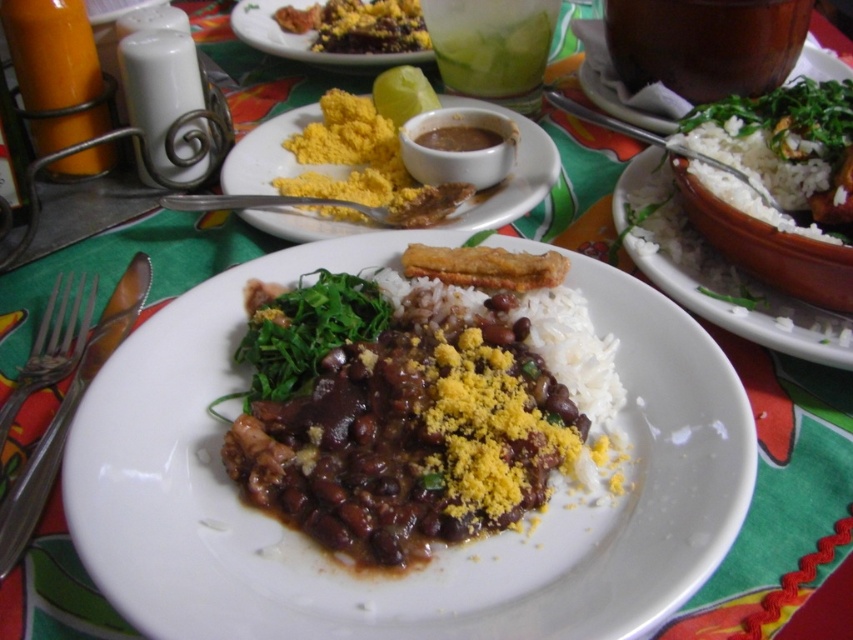
Question: Among these points, which one is nearest to the camera?

Choices:
 (A) pos(70,96)
 (B) pos(111,522)
 (C) pos(300,122)
 (D) pos(431,20)

Answer: (B)

Question: Is white matte plate at center below matte orange glass at upper left?

Choices:
 (A) yes
 (B) no

Answer: (A)

Question: Which point appears farthest from the camera in this image?

Choices:
 (A) (25, 102)
 (B) (819, 176)
 (C) (466, 13)
 (D) (403, 29)

Answer: (D)

Question: Does white rice at right have a smaller size compared to satin silver fork at lower left?

Choices:
 (A) no
 (B) yes

Answer: (A)

Question: Based on their relative distances, which object is nearer to the matte orange glass at upper left?

Choices:
 (A) white rice at right
 (B) white matte plate at center
 (C) matte brown beans at center

Answer: (C)

Question: Observing the image, what is the correct spatial positioning of white ceramic bowl at upper right in reference to matte orange glass at upper left?

Choices:
 (A) below
 (B) above

Answer: (A)